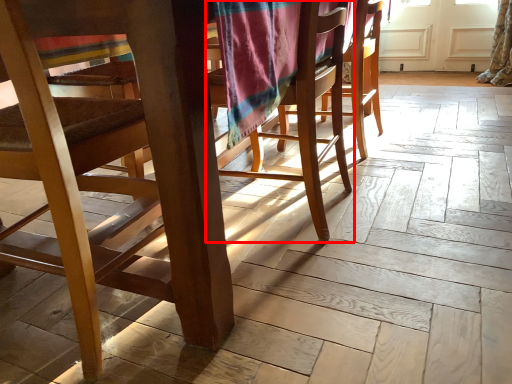
Question: From the image, what is the correct spatial relationship of chair (annotated by the red box) in relation to chair?

Choices:
 (A) right
 (B) left

Answer: (A)